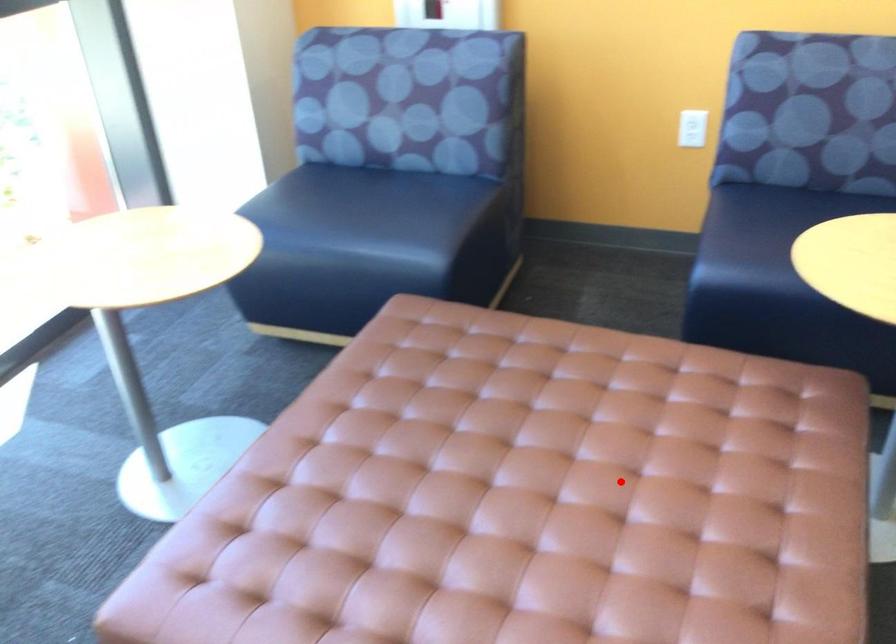
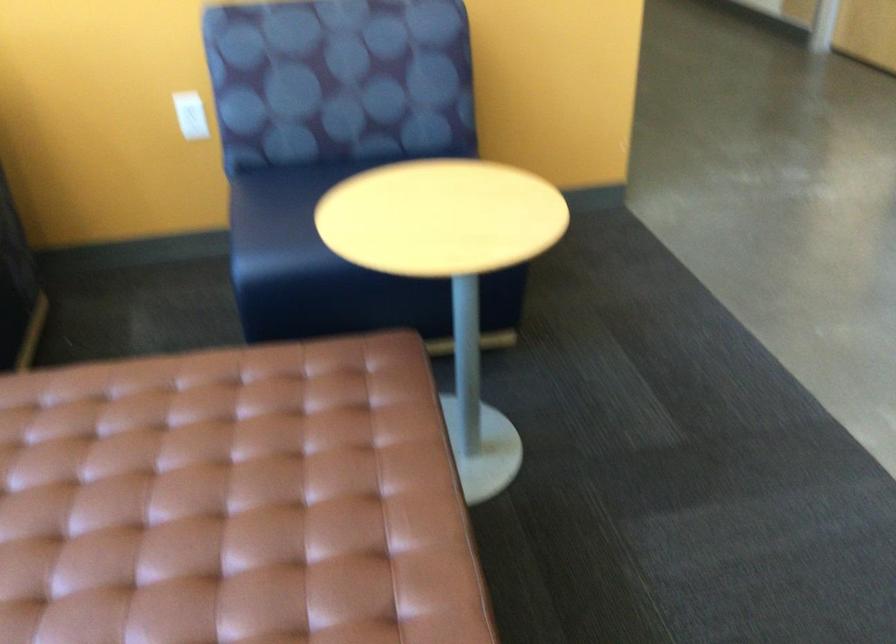
Find the pixel in the second image that matches the highlighted location in the first image.

(231, 502)